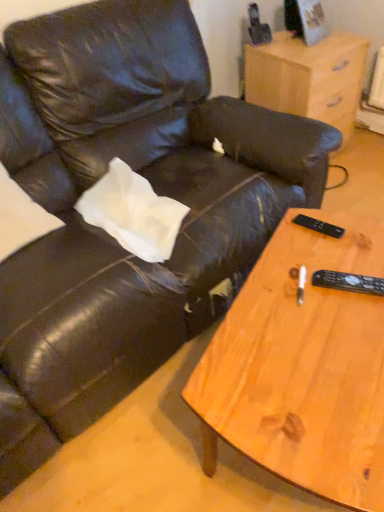
Find the location of `blank space situated above wooden coffee table at lower right (from a real-world perspective)`. blank space situated above wooden coffee table at lower right (from a real-world perspective) is located at coordinates (320, 316).